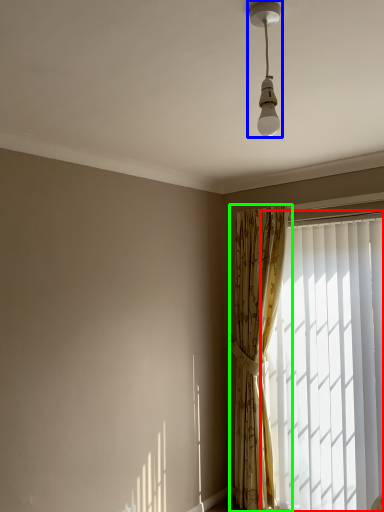
Question: Which object is positioned closest to window (highlighted by a red box)? Select from lamp (highlighted by a blue box) and curtain (highlighted by a green box).

Choices:
 (A) lamp
 (B) curtain

Answer: (B)